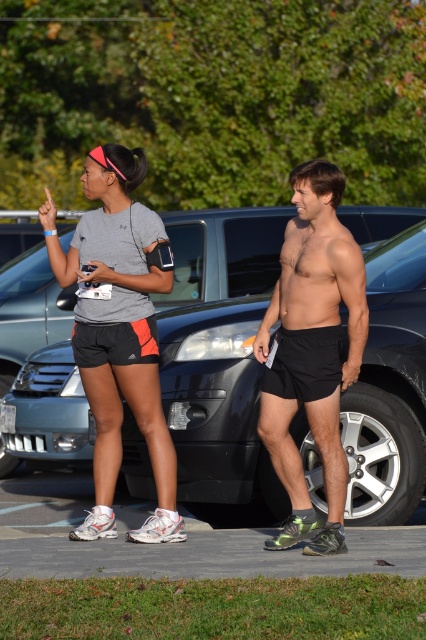
In the scene shown: Does matte gray shirt at center appear over black mesh shorts at center?

Yes.

Is point (147, 218) closer to camera compared to point (149, 352)?

That is False.

What do you see at coordinates (118, 332) in the screenshot?
I see `matte gray shirt at center` at bounding box center [118, 332].

Find the location of a particular element. matte gray shirt at center is located at coordinates (118, 332).

From the picture: Does matte gray shirt at center have a lesser height compared to shiny black shorts at center?

No.

Is point (143, 349) positioned after point (294, 406)?

Yes, point (143, 349) is behind point (294, 406).

You are a GUI agent. You are given a task and a screenshot of the screen. Output one action in this format:
    pyautogui.click(x=<x>, y=<y>)
    Task: Click on the matte gray shirt at center
    The height and width of the screenshot is (640, 426).
    Given the screenshot: What is the action you would take?
    pyautogui.click(x=118, y=332)

Describe the element at coordinates (221, 378) in the screenshot. Image resolution: width=426 pixels, height=640 pixels. I see `metallic gray car at center` at that location.

Who is more distant from viewer, (219,420) or (298,516)?

Positioned behind is point (219,420).

The image size is (426, 640). Identify the location of metallic gray car at center. (221, 378).